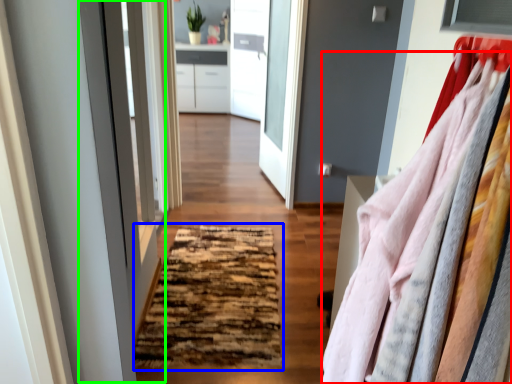
Question: Based on their relative distances, which object is farther from clothing (highlighted by a red box)? Choose from mat (highlighted by a blue box) and screen door (highlighted by a green box).

Choices:
 (A) mat
 (B) screen door

Answer: (B)